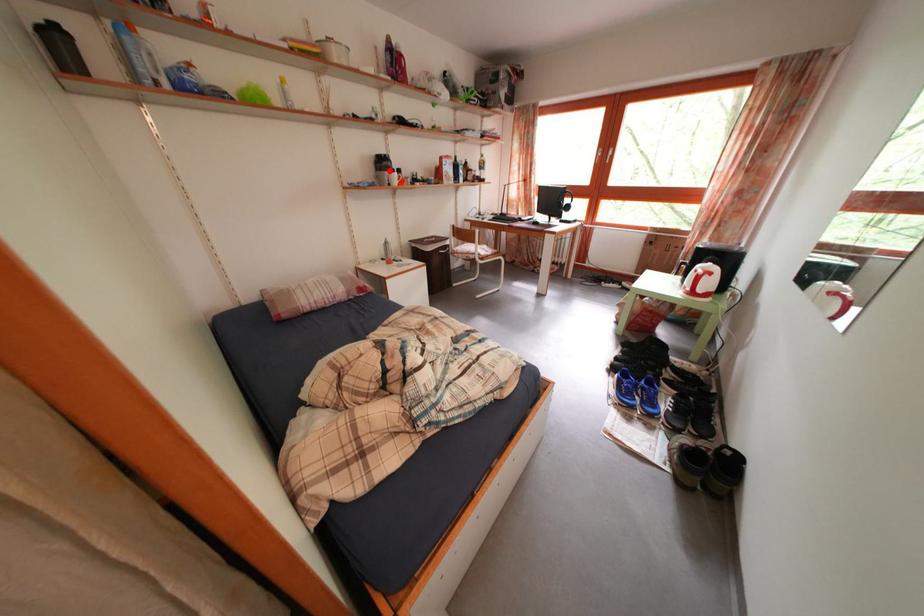
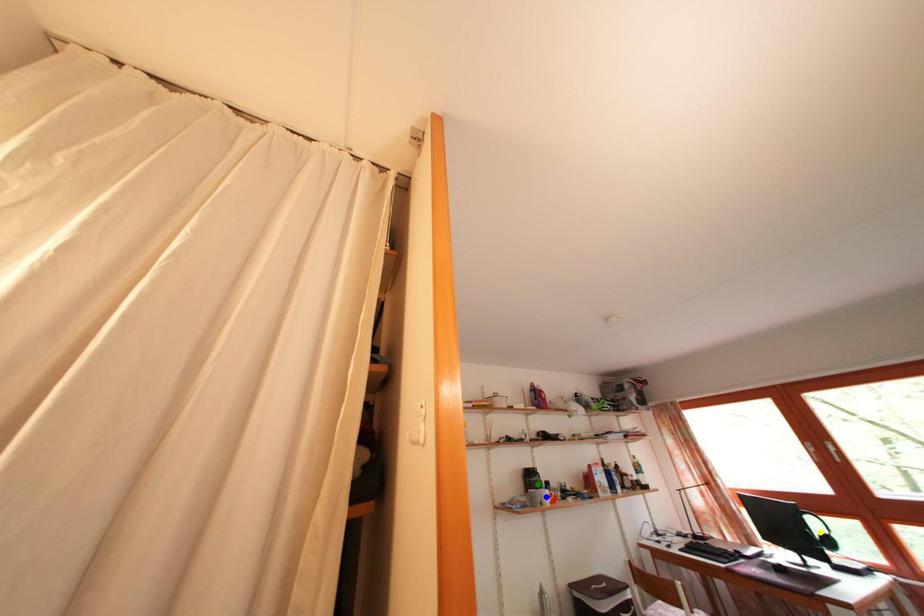
Question: I am providing you with two images of the same scene from different viewpoints. A red point is marked on the first image. You are given multiple points on the second image. In image 2, which mark is for the same physical point as the one in image 1?

Choices:
 (A) green point
 (B) blue point
 (C) yellow point

Answer: (A)